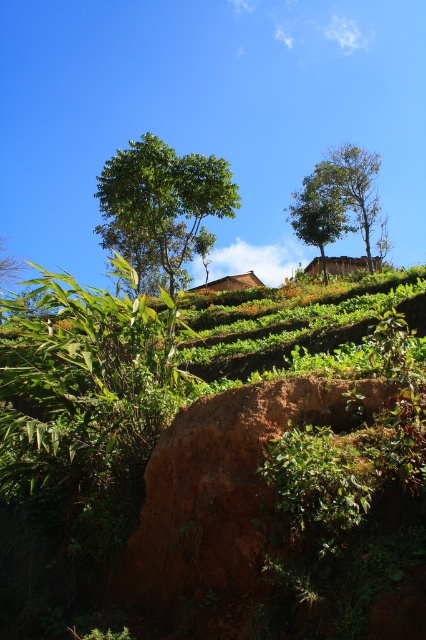
You are standing at the base of the mound of reddish brown earth in the foreground and want to walk towards the green leafy tree at upper center. Which direction should you head to avoid the green leafy tree at upper left?

To reach the green leafy tree at upper center while avoiding the green leafy tree at upper left, you should head to the right, as the green leafy tree at upper left is located to the left of the green leafy tree at upper center.

You are standing in the rural landscape and want to take a photo of the green leafy tree at upper left. If your camera can focus on objects up to 100 feet away, will you be able to capture a clear image of the tree?

The green leafy tree at upper left is 70.02 feet from viewer, so yes, the camera can focus on it since it is within the 100 feet range.

You are standing at the base of the mound of reddish brown earth in the foreground of the rural landscape. You see two points marked on the image, point (160, 166) and point (307, 241). Which point is closer to you?

Point (160, 166) is in front of point (307, 241), so it is closer to you.